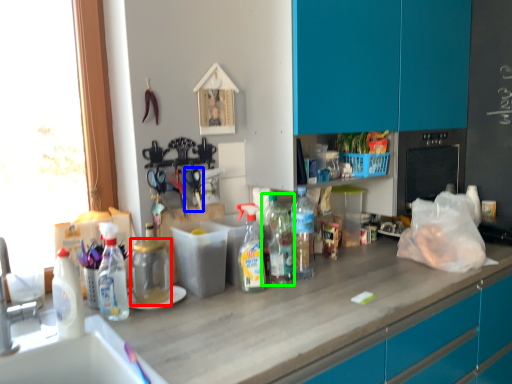
Question: Based on their relative distances, which object is nearer to bottle (highlighted by a red box)? Choose from scissors (highlighted by a blue box) and bottle (highlighted by a green box).

Choices:
 (A) scissors
 (B) bottle

Answer: (A)